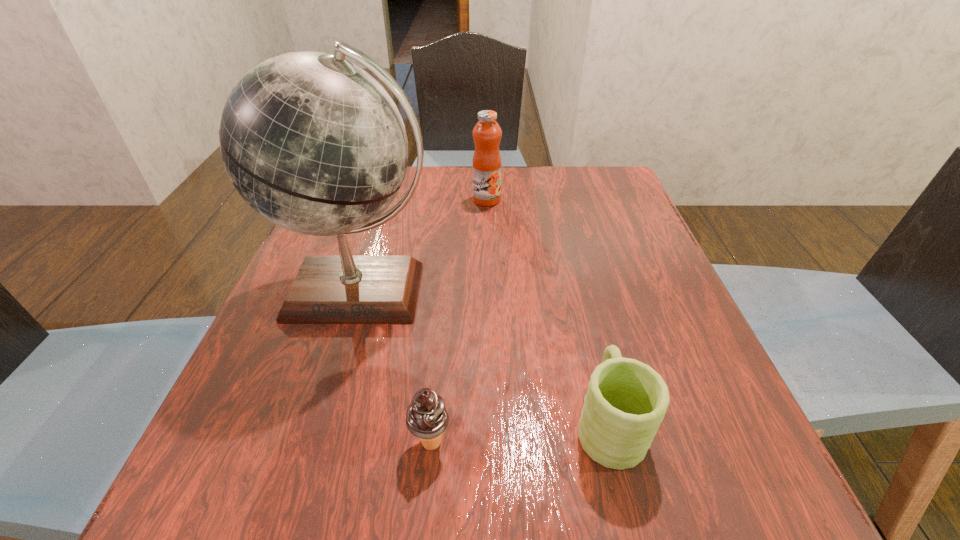
Find the location of `free point located 0.360m on the side of the rightmost object with the handle`. free point located 0.360m on the side of the rightmost object with the handle is located at coordinates (565, 246).

I want to click on free space located 0.260m on the side of the rightmost object with the handle, so click(x=573, y=275).

Where is `object that is at the far edge`? object that is at the far edge is located at coordinates (486, 164).

Find the location of a particular element. This screenshot has width=960, height=540. icecream that is at the near edge is located at coordinates (426, 417).

You are a GUI agent. You are given a task and a screenshot of the screen. Output one action in this format:
    pyautogui.click(x=<x>, y=<y>)
    Task: Click on the mug at the near edge
    
    Given the screenshot: What is the action you would take?
    pyautogui.click(x=626, y=400)

Identify the location of object located in the left edge section of the desktop. (314, 144).

Find the location of a particular element. Image resolution: width=960 pixels, height=540 pixels. object located at the right edge is located at coordinates (626, 400).

Image resolution: width=960 pixels, height=540 pixels. Identify the location of object present at the near right corner. (626, 400).

Locate an element on the screen. This screenshot has height=540, width=960. vacant area at the far edge is located at coordinates (514, 205).

You are a GUI agent. You are given a task and a screenshot of the screen. Output one action in this format:
    pyautogui.click(x=<x>, y=<y>)
    Task: Click on the vacant region at the near edge of the desktop
    
    Given the screenshot: What is the action you would take?
    pyautogui.click(x=338, y=465)